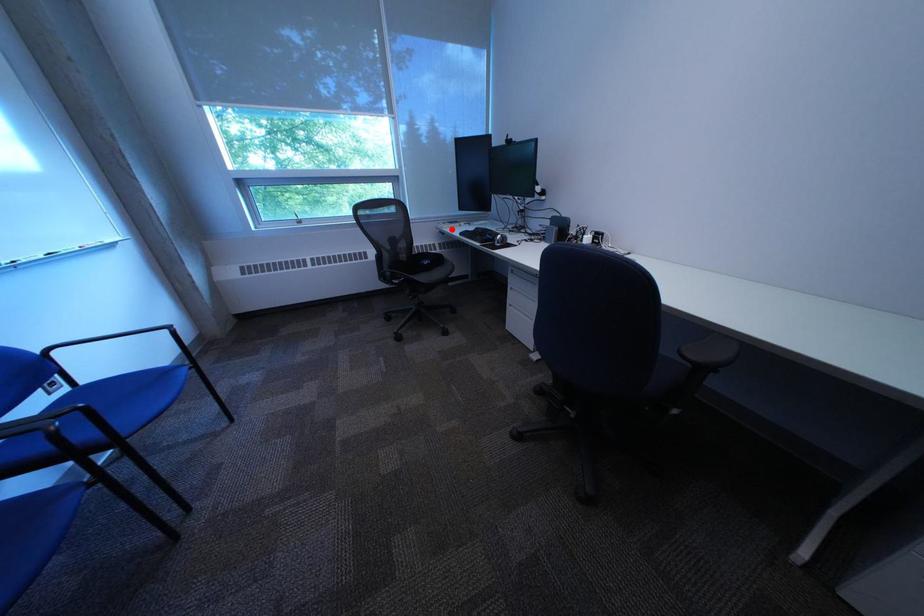
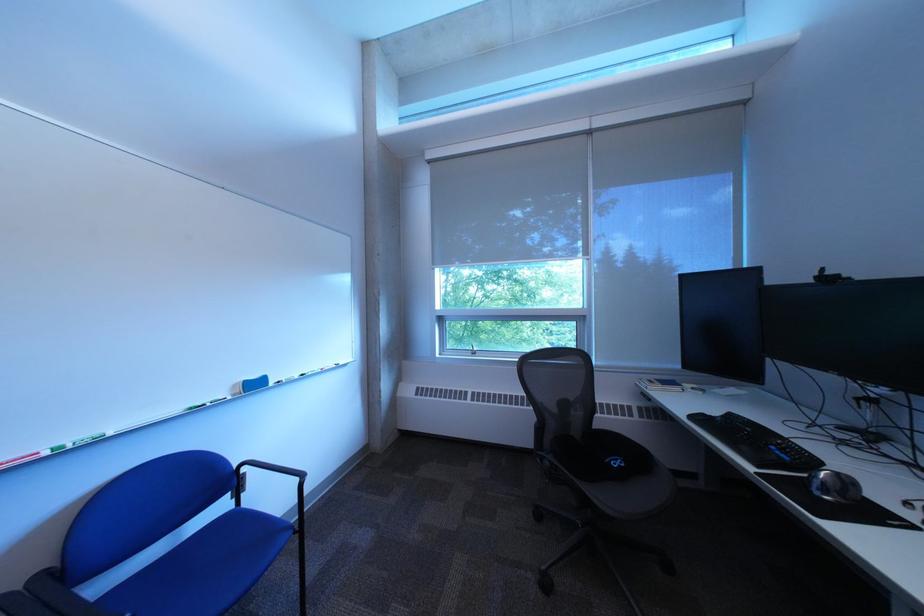
Question: A red point is marked in image1. In image2, is the corresponding 3D point closer to the camera or farther? Reply with the corresponding letter.

Choices:
 (A) The corresponding 3D point is closer.
 (B) The corresponding 3D point is farther.

Answer: (B)